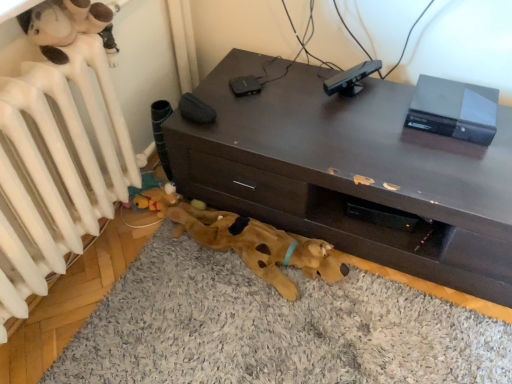
Question: Is white matte radiator at upper left positioned with its back to black matte sensor at upper center?

Choices:
 (A) yes
 (B) no

Answer: (B)

Question: Is black matte sensor at upper center a part of white matte radiator at upper left?

Choices:
 (A) yes
 (B) no

Answer: (B)

Question: Is white matte radiator at upper left further to camera compared to black matte sensor at upper center?

Choices:
 (A) no
 (B) yes

Answer: (A)

Question: From the image's perspective, is white matte radiator at upper left below black matte sensor at upper center?

Choices:
 (A) no
 (B) yes

Answer: (B)

Question: Considering the relative positions of white matte radiator at upper left and black matte sensor at upper center in the image provided, is white matte radiator at upper left to the left of black matte sensor at upper center from the viewer's perspective?

Choices:
 (A) no
 (B) yes

Answer: (B)

Question: Considering the positions of brown plush dog bed at lower center and black matte sensor at upper center in the image, is brown plush dog bed at lower center taller or shorter than black matte sensor at upper center?

Choices:
 (A) short
 (B) tall

Answer: (A)

Question: Considering the positions of brown plush dog bed at lower center and black matte sensor at upper center in the image, is brown plush dog bed at lower center wider or thinner than black matte sensor at upper center?

Choices:
 (A) wide
 (B) thin

Answer: (A)

Question: Is brown plush dog bed at lower center to the left or to the right of black matte sensor at upper center in the image?

Choices:
 (A) left
 (B) right

Answer: (A)

Question: From the image's perspective, is brown plush dog bed at lower center above or below black matte sensor at upper center?

Choices:
 (A) above
 (B) below

Answer: (B)

Question: In the image, is white matte radiator at upper left positioned in front of or behind brown plush dog at lower center?

Choices:
 (A) behind
 (B) front

Answer: (B)

Question: From their relative heights in the image, would you say white matte radiator at upper left is taller or shorter than brown plush dog at lower center?

Choices:
 (A) short
 (B) tall

Answer: (B)

Question: Considering the positions of point (61, 195) and point (181, 210), is point (61, 195) closer or farther from the camera than point (181, 210)?

Choices:
 (A) closer
 (B) farther

Answer: (A)

Question: From the image's perspective, is white matte radiator at upper left above or below brown plush dog at lower center?

Choices:
 (A) below
 (B) above

Answer: (B)

Question: From a real-world perspective, relative to brown plush dog bed at lower center, is white matte radiator at upper left vertically above or below?

Choices:
 (A) above
 (B) below

Answer: (A)

Question: Is white matte radiator at upper left to the left or to the right of brown plush dog bed at lower center in the image?

Choices:
 (A) right
 (B) left

Answer: (B)